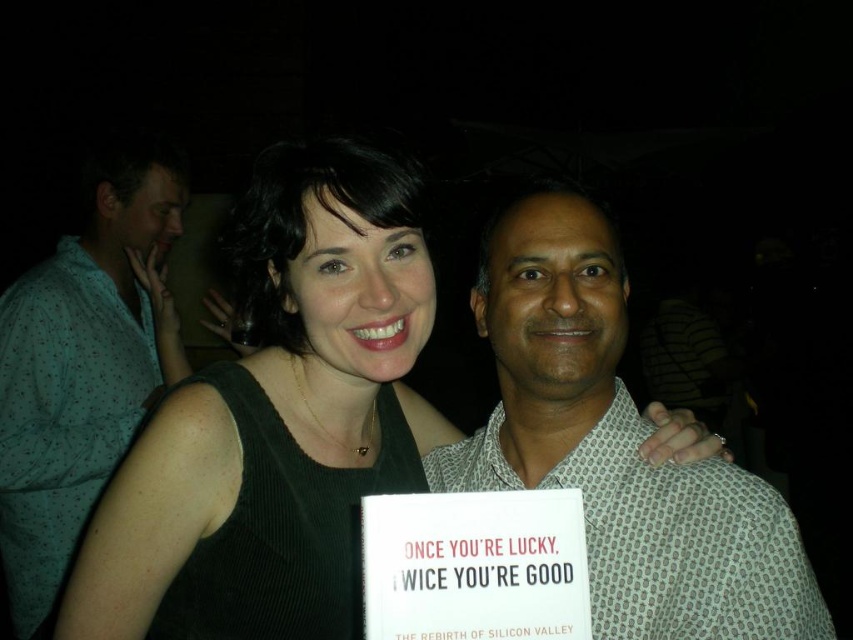
You are a photographer at a social event. You need to decide whether to adjust the camera focus to ensure both the black fabric dress at center and the green dotted shirt at left are in focus. Based on their heights, which object is shorter and requires closer attention to focus?

The black fabric dress at center is not as tall as the green dotted shirt at left, so the black fabric dress at center is shorter and may require closer attention to focus.

What is the exact location of the black fabric dress at center in the image?

The black fabric dress at center is located at point (274, 416).

Based on the scene description, what is the 2D coordinate of the green dotted shirt at left?

The 2D coordinate of the green dotted shirt at left is at point (x=83, y=364).